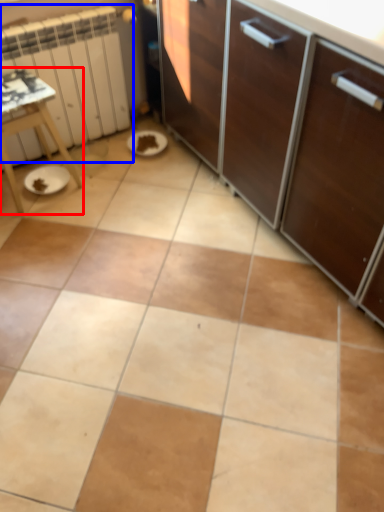
Question: Among these objects, which one is farthest to the camera, table (highlighted by a red box) or radiator (highlighted by a blue box)?

Choices:
 (A) table
 (B) radiator

Answer: (B)